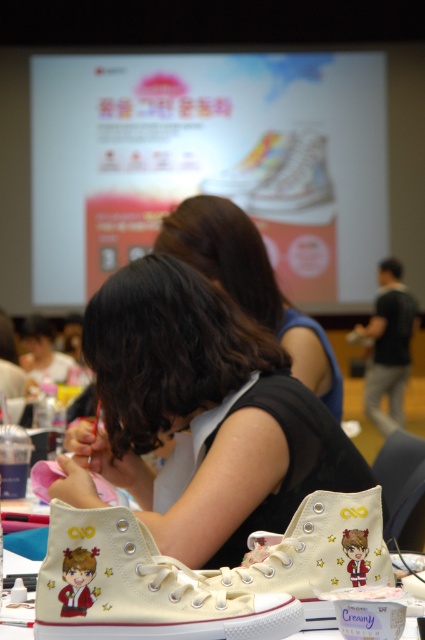
You are an event organizer who wants to place a decorative banner at point 0.650, 0.475. Is there space to place it there without overlapping the matte white sneakers at lower center?

Yes, you can place the banner at point (201, 416) because the matte white sneakers at lower center are exactly at that point, so placing the banner there would overlap them. Therefore, you should choose a different location.